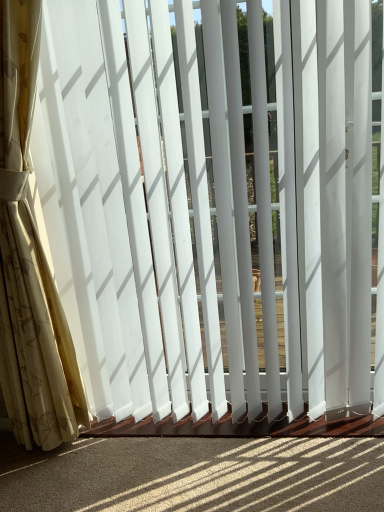
Find the location of a particular element. This screenshot has width=384, height=512. white sheer curtain at left is located at coordinates (29, 261).

The height and width of the screenshot is (512, 384). What do you see at coordinates (29, 261) in the screenshot?
I see `white sheer curtain at left` at bounding box center [29, 261].

In order to click on white sheer curtain at left in this screenshot , I will do `click(29, 261)`.